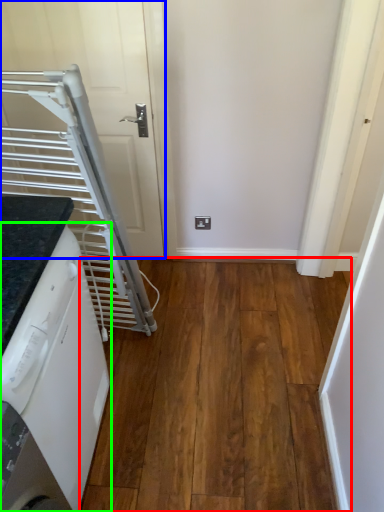
Question: Which object is positioned farthest from hardwood (highlighted by a red box)? Select from door (highlighted by a blue box) and home appliance (highlighted by a green box).

Choices:
 (A) door
 (B) home appliance

Answer: (A)